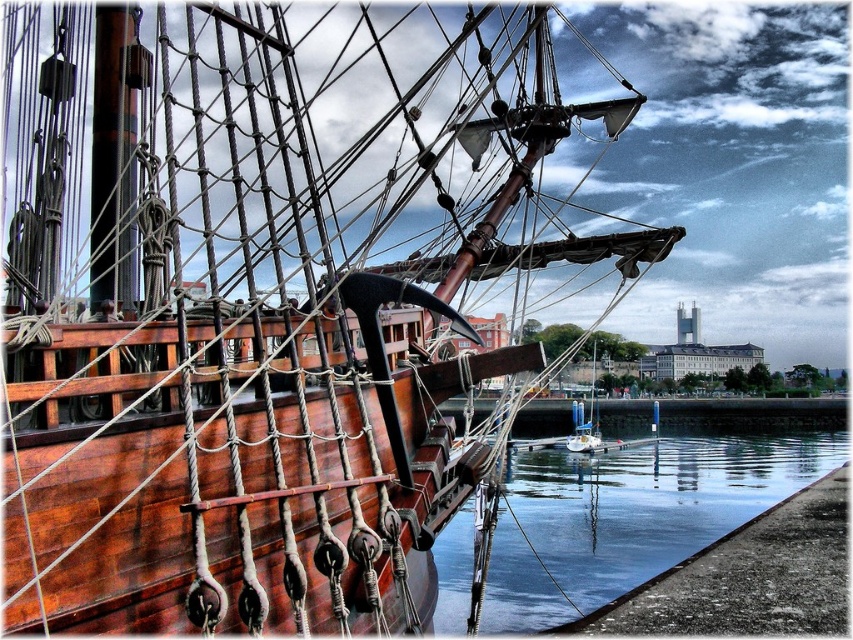
Is clear glass water at lower right to the left of wooden sailboat at center from the viewer's perspective?

Yes, clear glass water at lower right is to the left of wooden sailboat at center.

Does point (772, 496) lie behind point (593, 388)?

No, (772, 496) is in front of (593, 388).

Find the location of a particular element. This screenshot has height=640, width=853. clear glass water at lower right is located at coordinates (630, 515).